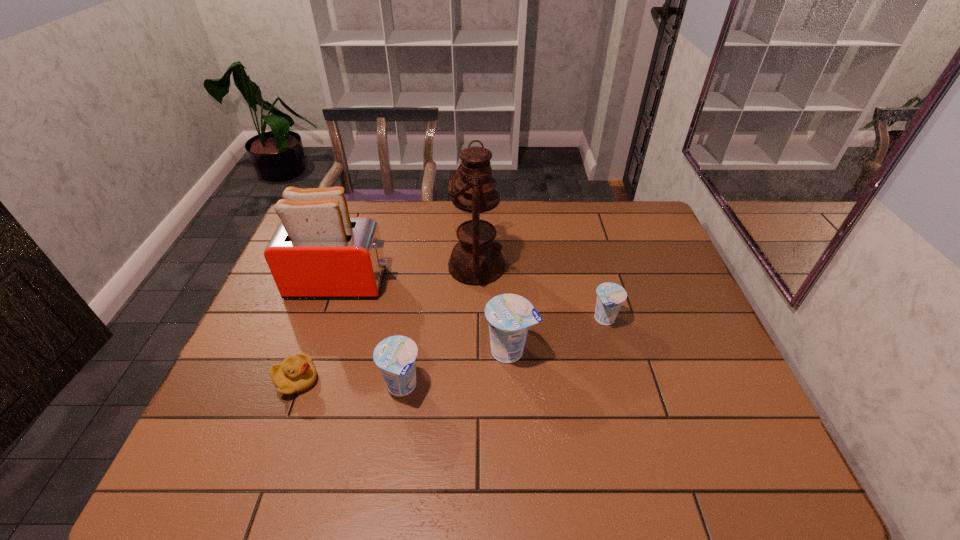
Locate an element on the screen. Image resolution: width=960 pixels, height=540 pixels. vacant space at the far edge of the desktop is located at coordinates (377, 219).

This screenshot has height=540, width=960. Find the location of `vacant space at the near edge of the desktop`. vacant space at the near edge of the desktop is located at coordinates (582, 399).

The height and width of the screenshot is (540, 960). In the image, there is a desktop. What are the coordinates of `blank space at the left edge` in the screenshot? It's located at (263, 392).

In the image, there is a desktop. Find the location of `vacant space at the right edge`. vacant space at the right edge is located at coordinates (663, 316).

Identify the location of vacant space at the near left corner of the desktop. (240, 415).

I want to click on vacant area between the rightmost yogurt and the second tallest object, so click(x=472, y=301).

The width and height of the screenshot is (960, 540). Find the location of `free space between the toaster and the fourth tallest object`. free space between the toaster and the fourth tallest object is located at coordinates pyautogui.click(x=371, y=335).

Identify the location of free space between the tallest yogurt and the toaster. The width and height of the screenshot is (960, 540). (425, 316).

Locate an element on the screen. The width and height of the screenshot is (960, 540). free space that is in between the tallest object and the third farthest object is located at coordinates (540, 293).

This screenshot has height=540, width=960. I want to click on empty space between the fourth object from right to left and the tallest object, so click(439, 326).